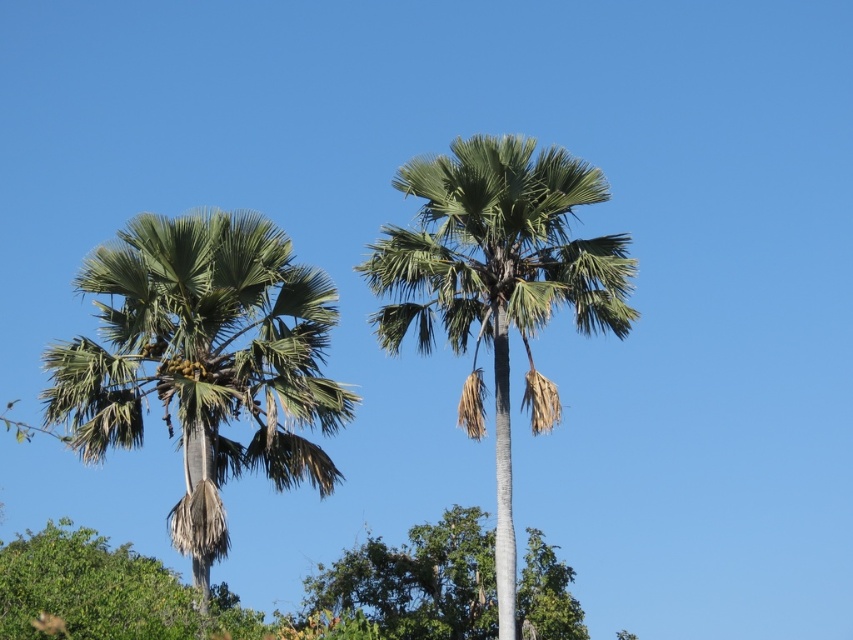
Who is shorter, green leafy palm at left or green leafy tree at center?

With less height is green leafy tree at center.

Is green leafy palm at left wider than green leafy tree at center?

Incorrect, green leafy palm at left's width does not surpass green leafy tree at center's.

Identify the location of green leafy palm at left. (202, 362).

The image size is (853, 640). In order to click on green leafy palm at left in this screenshot , I will do `click(202, 362)`.

Does green leafy palm at left appear under green leafy palm at center?

Correct, green leafy palm at left is located below green leafy palm at center.

How distant is green leafy palm at left from green leafy palm at center?

green leafy palm at left and green leafy palm at center are 36.02 feet apart.

Describe the element at coordinates (202, 362) in the screenshot. I see `green leafy palm at left` at that location.

Identify the location of green leafy palm at left. (202, 362).

The image size is (853, 640). Describe the element at coordinates (498, 284) in the screenshot. I see `green leafy palm at center` at that location.

Does green leafy palm at center have a smaller size compared to green leafy tree at center?

No, green leafy palm at center is not smaller than green leafy tree at center.

Does point (396, 288) lie in front of point (566, 628)?

That is True.

Where is `green leafy palm at center`? This screenshot has width=853, height=640. green leafy palm at center is located at coordinates (x=498, y=284).